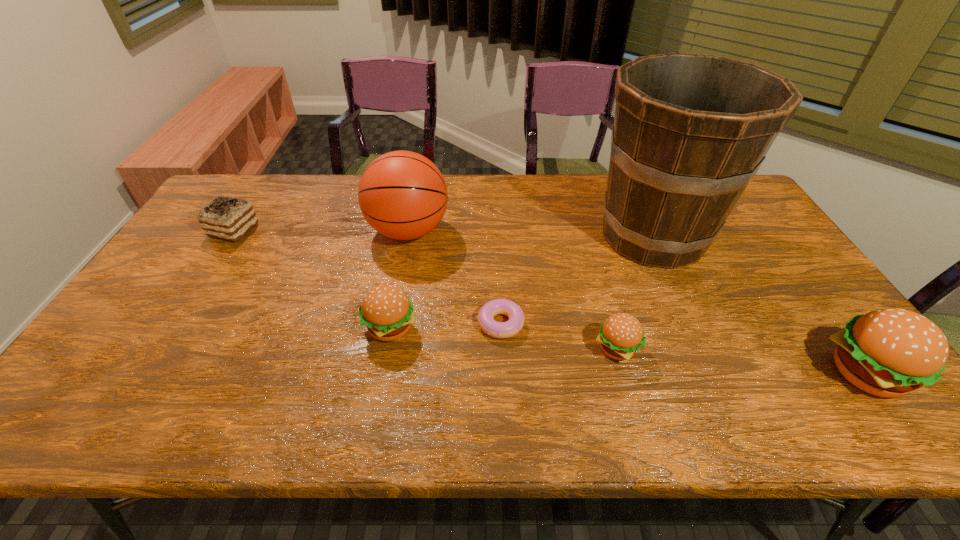
I want to click on the second shortest hamburger, so click(x=387, y=312).

The width and height of the screenshot is (960, 540). I want to click on the fourth shortest object, so click(387, 312).

Image resolution: width=960 pixels, height=540 pixels. I want to click on the second hamburger from right to left, so click(x=621, y=335).

The image size is (960, 540). Find the location of `the rightmost hamburger`. the rightmost hamburger is located at coordinates (890, 352).

Locate an element on the screen. This screenshot has width=960, height=540. the rightmost object is located at coordinates (890, 352).

Where is `the leftmost object`? This screenshot has width=960, height=540. the leftmost object is located at coordinates [x=227, y=218].

Locate an element on the screen. This screenshot has height=540, width=960. the tallest object is located at coordinates (690, 131).

Locate an element on the screen. basketball is located at coordinates (403, 195).

Identify the location of doughnut. This screenshot has width=960, height=540. (495, 329).

The width and height of the screenshot is (960, 540). I want to click on the fourth object from left to right, so click(x=495, y=329).